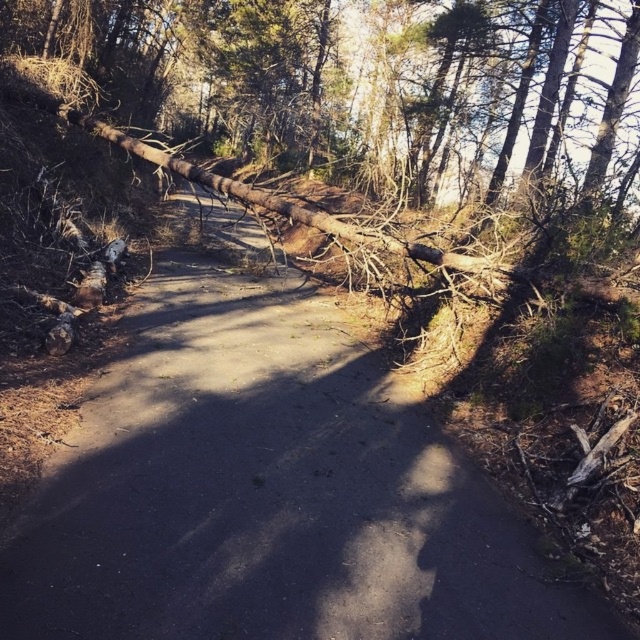
You are standing at the edge of the forest path and want to walk towards the two points marked in the image. Which point, point (317,339) or point (268,148), will you reach first?

Point (317,339) is closer to the camera than point (268,148), so you will reach point (317,339) first.

You are standing at the point labeled as point (269, 492) in the forest scene. What is the terrain like here?

The point labeled as point (269, 492) indicates brown dirt path at center.

You are a hiker trying to navigate through the forest. You see the brown dirt path at center and the brown rough log at upper center. Which one is narrower between them?

The brown dirt path at center is narrower than the brown rough log at upper center.